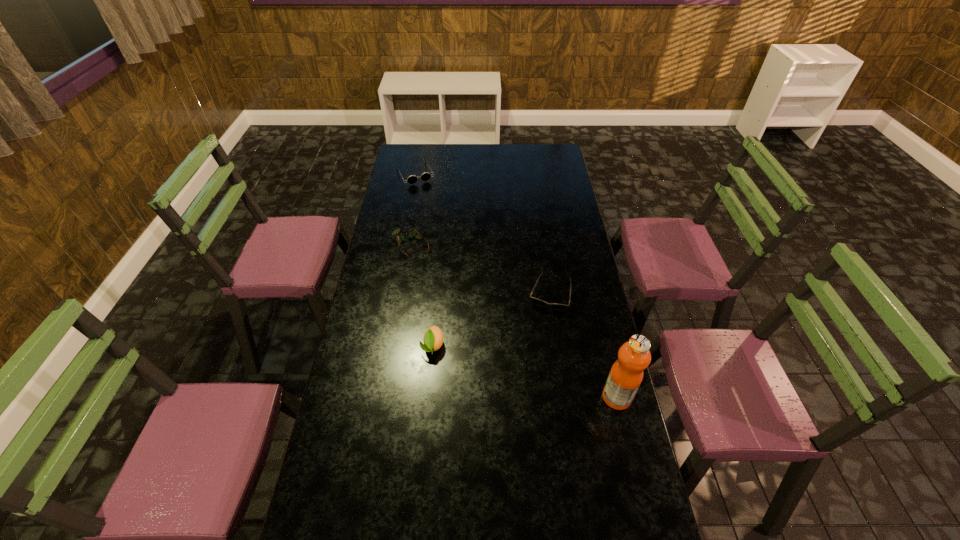
This screenshot has height=540, width=960. In order to click on free spot on the desktop that is between the second nearest object and the fruit juice and is positioned on the front-facing side of the fourth nearest object in this screenshot , I will do `click(495, 363)`.

Locate an element on the screen. The height and width of the screenshot is (540, 960). free space on the desktop that is between the second tallest object and the rightmost object and is positioned on the front-facing side of the taller sunglasses is located at coordinates (519, 370).

Find the location of a particular element. The image size is (960, 540). vacant space on the desktop that is between the second nearest object and the rightmost object and is positioned on the front-facing side of the right sunglasses is located at coordinates (529, 373).